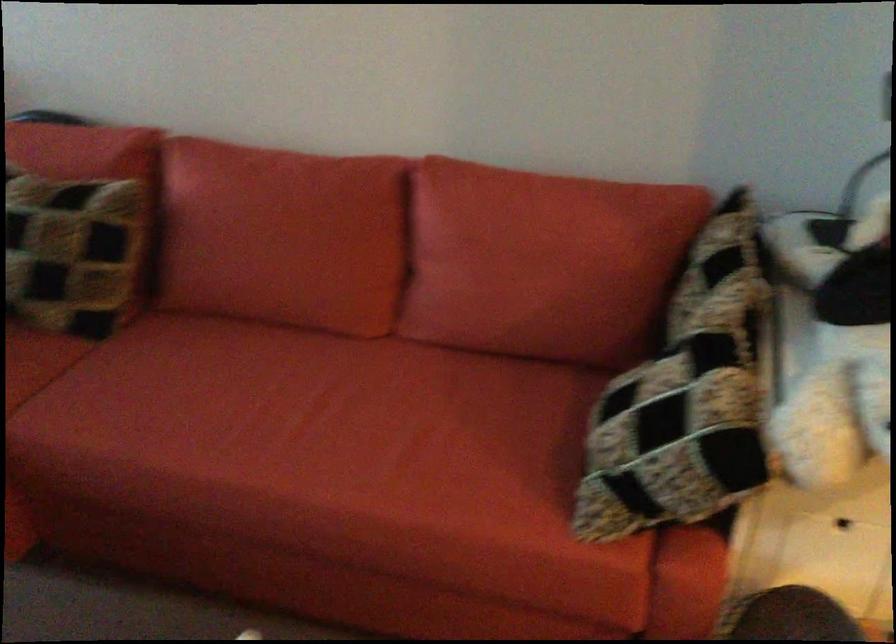
I want to click on sofa sitting surface, so click(x=787, y=341).